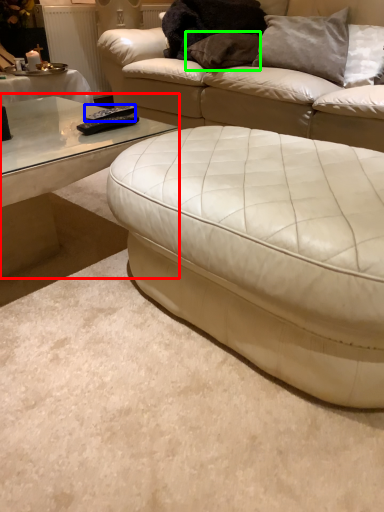
Question: Which is nearer to the coffee table (highlighted by a red box)? remote (highlighted by a blue box) or pillow (highlighted by a green box).

Choices:
 (A) remote
 (B) pillow

Answer: (A)